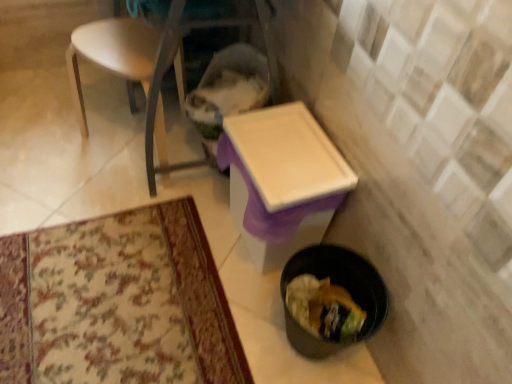
The width and height of the screenshot is (512, 384). Identify the location of vacant space to the left of white plastic table at center. (188, 230).